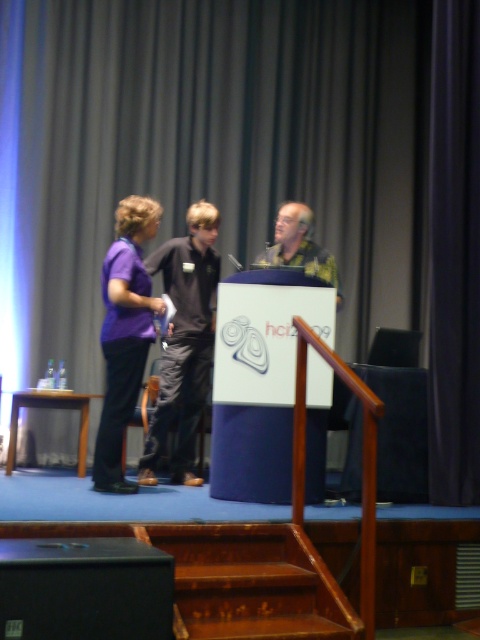
You are an event organizer trying to arrange seating for a panel discussion. You need to place a chair for the black matte speaker at lower left and another for the purple matte shirt at left. Based on their current positions, which speaker requires a smaller chair?

The black matte speaker at lower left requires a smaller chair since it occupies less space than the purple matte shirt at left.